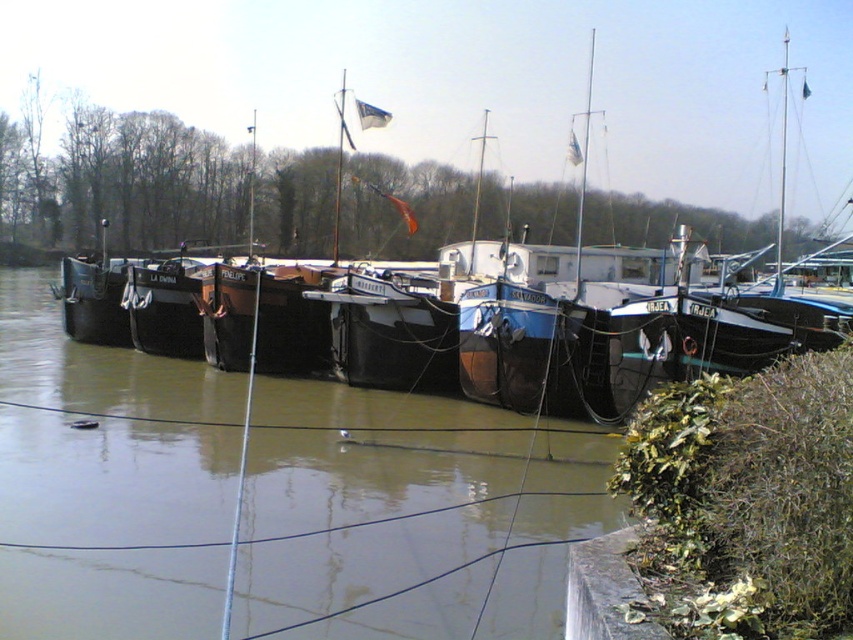
Which of these two, brown matte water at center or blue wooden boat at center, stands shorter?

brown matte water at center is shorter.

Is point (279, 380) less distant than point (473, 362)?

No, (279, 380) is behind (473, 362).

Is point (544, 492) behind point (440, 256)?

That is False.

Find the location of `brown matte water at center`. brown matte water at center is located at coordinates (409, 515).